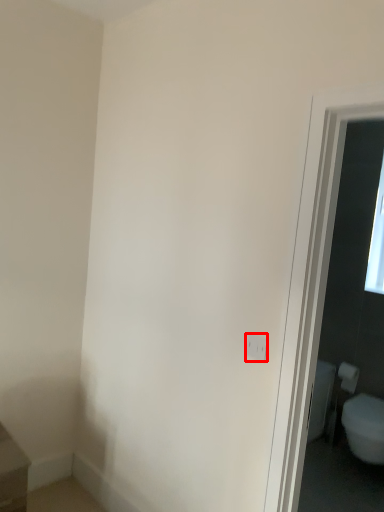
Question: Considering the relative positions of electric outlet (annotated by the red box) and toilet paper in the image provided, where is electric outlet (annotated by the red box) located with respect to the staircase?

Choices:
 (A) left
 (B) right

Answer: (A)